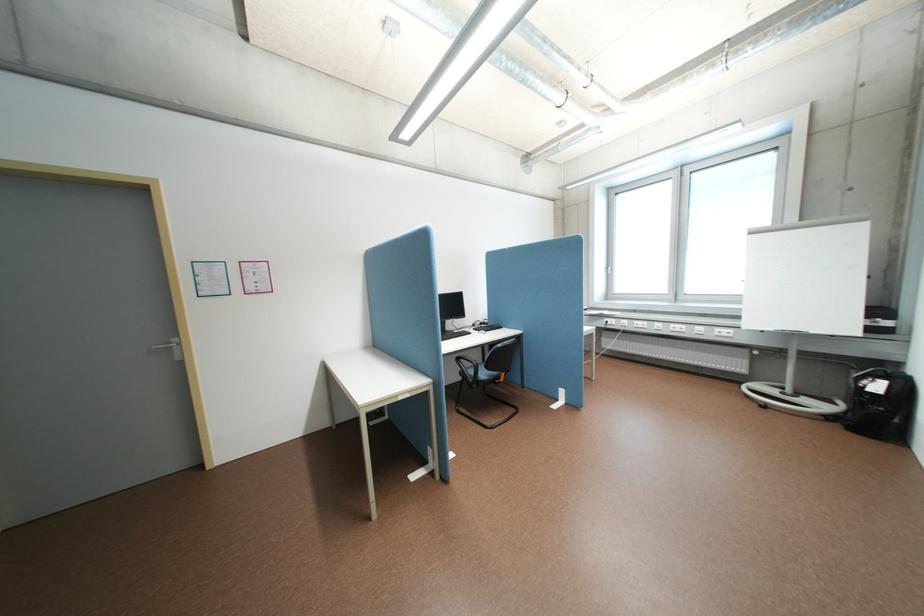
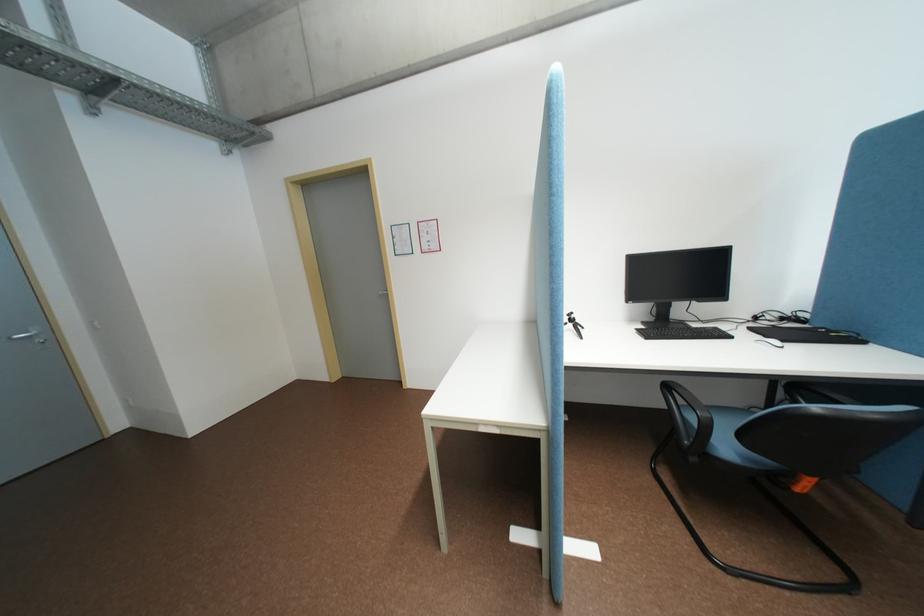
Where in the second image is the point corresponding to [513,379] from the first image?

(808, 488)